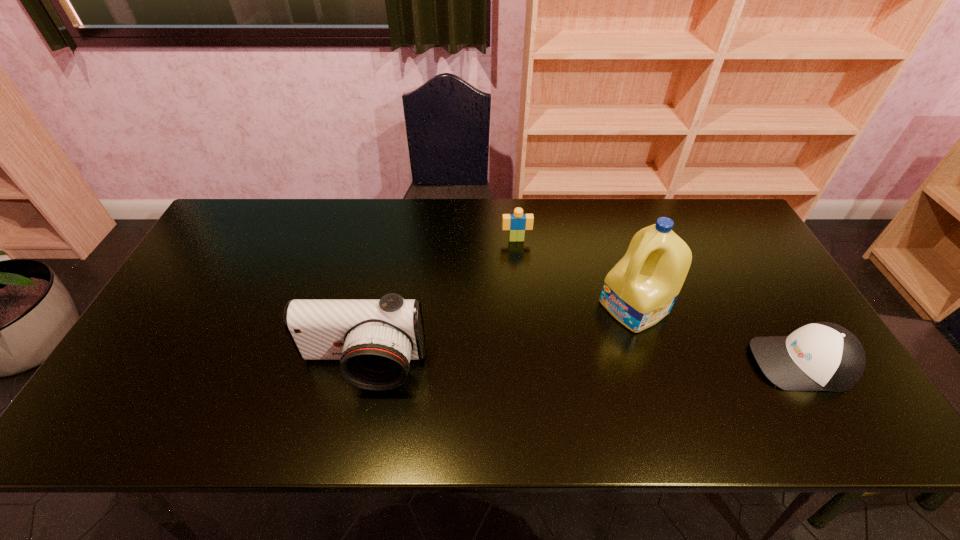
Find the location of `vacant space in between the detergent and the Lego`. vacant space in between the detergent and the Lego is located at coordinates (575, 273).

Identify which object is the second closest to the tallest object. Please provide its 2D coordinates. Your answer should be formatted as a tuple, i.e. [(x, y)], where the tuple contains the x and y coordinates of a point satisfying the conditions above.

[(517, 223)]

In order to click on the closest object to the rightmost object in this screenshot , I will do `click(640, 290)`.

The width and height of the screenshot is (960, 540). I want to click on vacant region that satisfies the following two spatial constraints: 1. on the front side of the Lego; 2. on the right side of the tallest object, so click(x=522, y=307).

This screenshot has height=540, width=960. In order to click on free spot that satisfies the following two spatial constraints: 1. on the front side of the detergent; 2. on the front panel of the cap in this screenshot , I will do `click(651, 363)`.